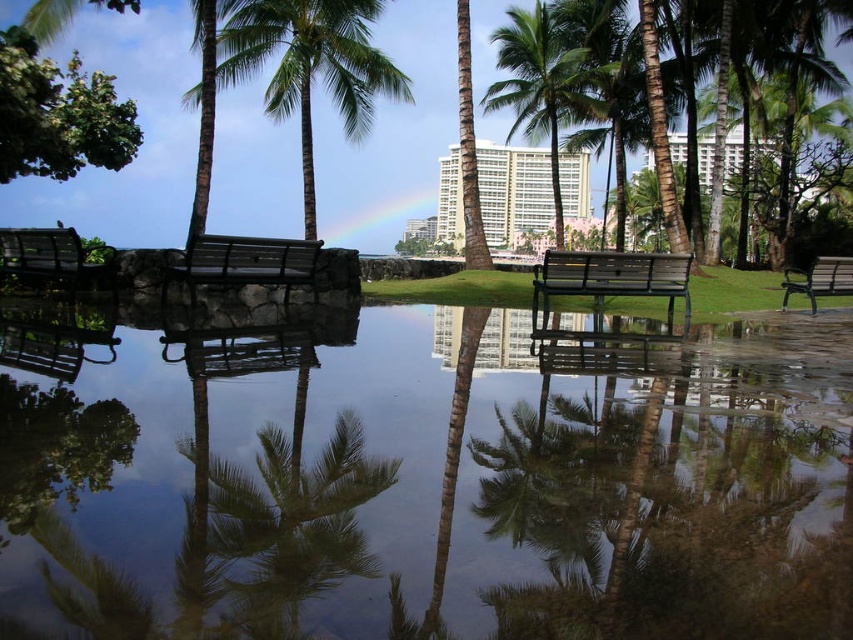
You are planning to place a small decorative statue between the green leafy palm tree at center and the metallic black bench at center. Based on their widths, which object should the statue be closer to?

The statue should be closer to the metallic black bench at center because the green leafy palm tree at center might be wider than the bench, leaving less space between them.

You are a photographer setting up a tripod in the middle of the scene. You need to position it between the metallic black bench at center and the metallic silver bench at center. Which bench should you place the tripod closer to if you want it to be at the same height as the benches?

The metallic black bench at center is taller than the metallic silver bench at center. To position the tripod at the same height as the benches, place it closer to the metallic silver bench at center since it is shorter.